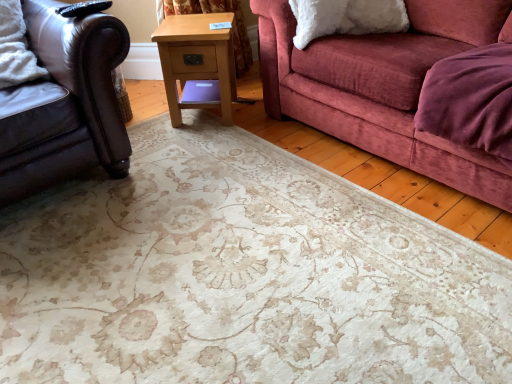
Question: From a real-world perspective, relative to leather couch at left, is light wood/texture side table at center vertically above or below?

Choices:
 (A) above
 (B) below

Answer: (B)

Question: In terms of size, does light wood/texture side table at center appear bigger or smaller than leather couch at left?

Choices:
 (A) small
 (B) big

Answer: (A)

Question: Is light wood/texture side table at center taller or shorter than leather couch at left?

Choices:
 (A) short
 (B) tall

Answer: (A)

Question: From a real-world perspective, relative to light wood/texture side table at center, is leather couch at left vertically above or below?

Choices:
 (A) above
 (B) below

Answer: (A)

Question: Which is correct: leather couch at left is inside light wood/texture side table at center, or outside of it?

Choices:
 (A) inside
 (B) outside

Answer: (B)

Question: In terms of size, does leather couch at left appear bigger or smaller than light wood/texture side table at center?

Choices:
 (A) big
 (B) small

Answer: (A)

Question: In terms of height, does leather couch at left look taller or shorter compared to light wood/texture side table at center?

Choices:
 (A) tall
 (B) short

Answer: (A)